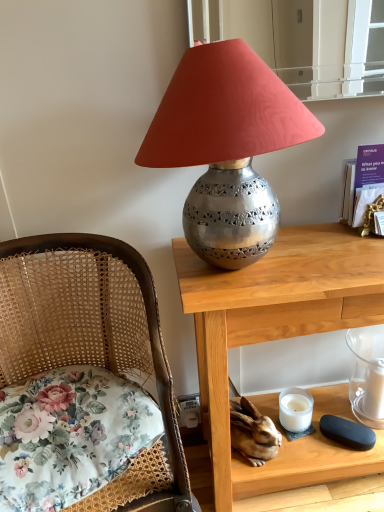
Identify the location of vacant area situated to the left side of purple paper at upper right. This screenshot has width=384, height=512. (325, 240).